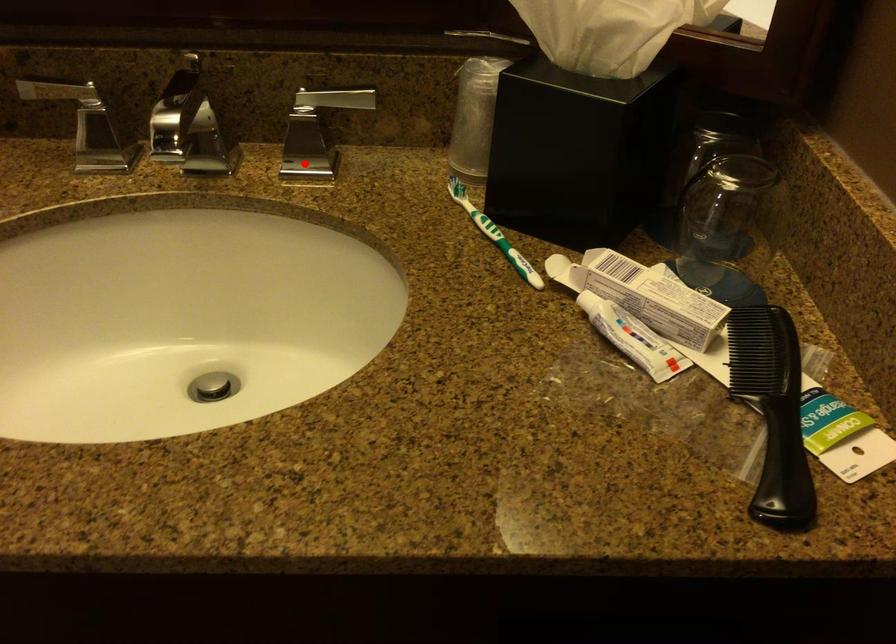
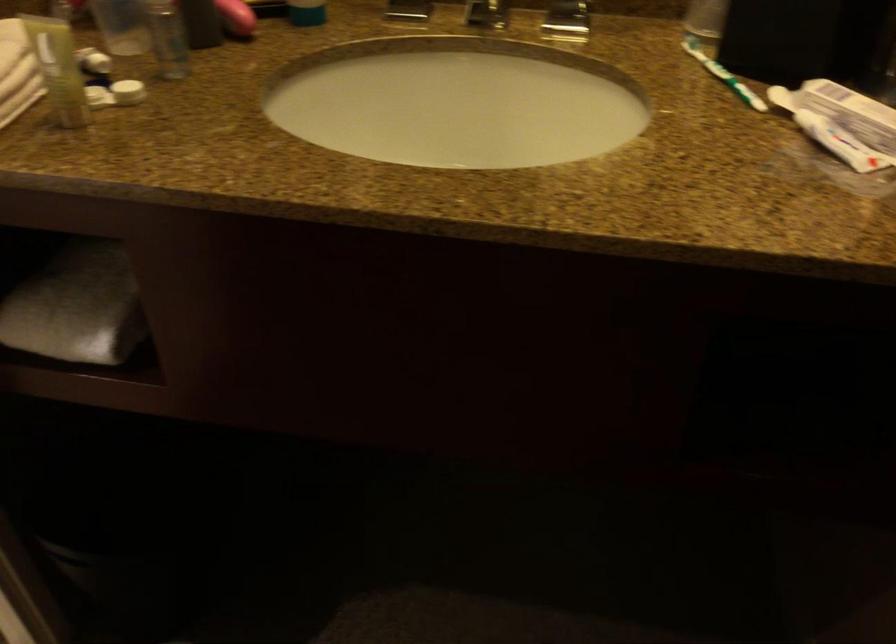
Question: I am providing you with two images of the same scene from different viewpoints. A red point is marked on the first image. Can you still see the location of the red point in image 2?

Choices:
 (A) Yes
 (B) No

Answer: (A)